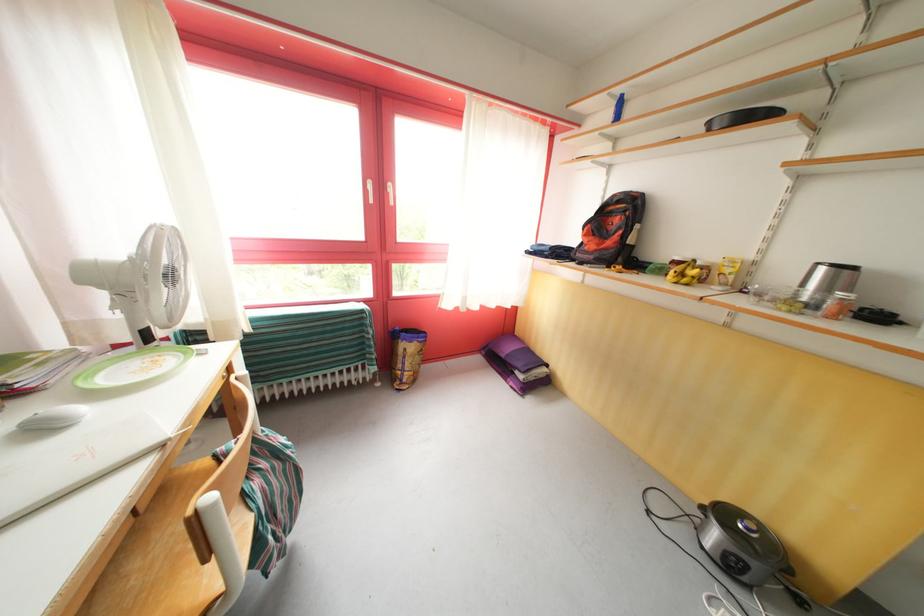
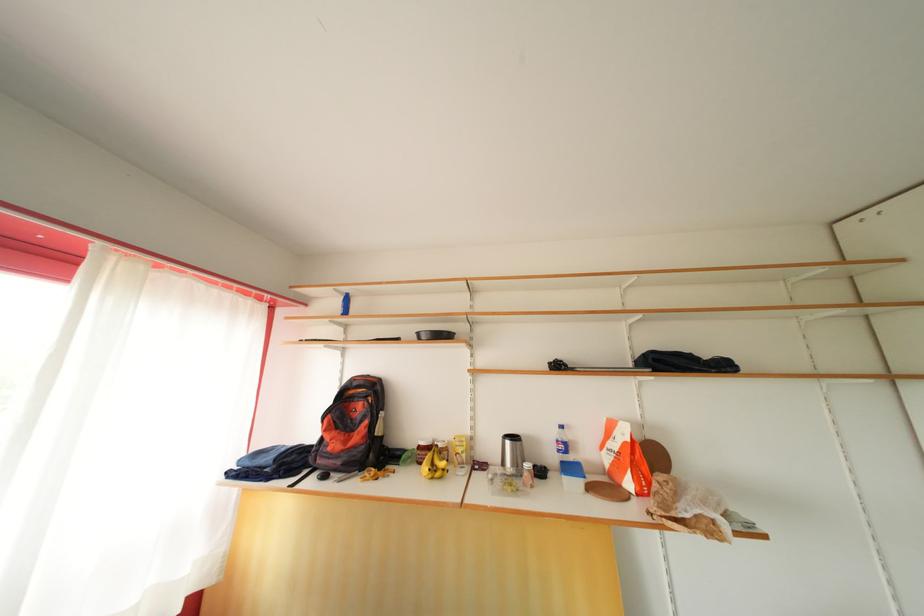
The point at (x=829, y=275) is marked in the first image. Where is the corresponding point in the second image?

(515, 448)